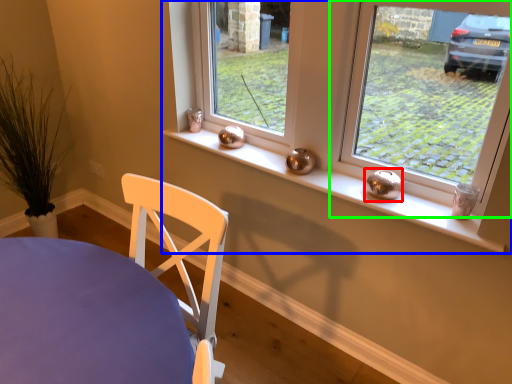
Question: Which is nearer to the candle holder (highlighted by a red box)? window (highlighted by a blue box) or window (highlighted by a green box).

Choices:
 (A) window
 (B) window

Answer: (A)